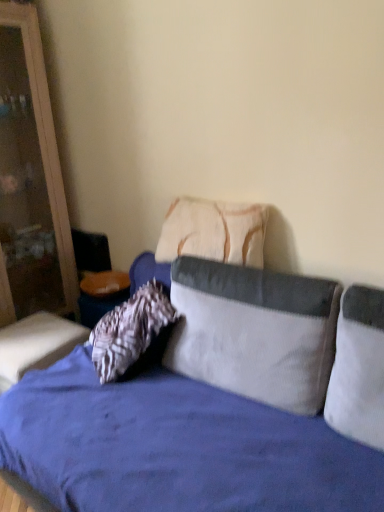
Question: Is white corduroy pillow at center, the second pillow when ordered from back to front, situated inside velvet cushion at lower left or outside?

Choices:
 (A) inside
 (B) outside

Answer: (B)

Question: From a real-world perspective, is white corduroy pillow at center, acting as the 2th pillow starting from the front, above or below velvet cushion at lower left?

Choices:
 (A) above
 (B) below

Answer: (A)

Question: Which object is the farthest from the velvet blue studio couch at center?

Choices:
 (A) wooden dresser at left
 (B) white corduroy pillow at right, the 1th pillow positioned from the front
 (C) white corduroy pillow at center, acting as the 2th pillow starting from the front
 (D) textured beige pillow at center, which appears as the first pillow when viewed from the back
 (E) velvet cushion at lower left

Answer: (B)

Question: Which is farther from the textured beige pillow at center, placed as the 3th pillow when sorted from front to back?

Choices:
 (A) white corduroy pillow at right, the 3th pillow viewed from the back
 (B) white corduroy pillow at center, the second pillow when ordered from back to front
 (C) wooden dresser at left
 (D) velvet blue studio couch at center
 (E) velvet cushion at lower left

Answer: (C)